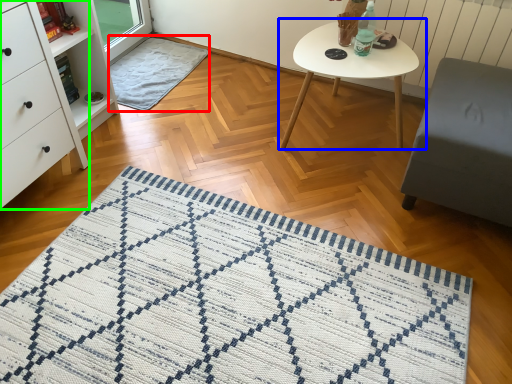
Question: Which object is the closest to the blanket (highlighted by a red box)? Choose among these: coffee table (highlighted by a blue box) or chest of drawers (highlighted by a green box).

Choices:
 (A) coffee table
 (B) chest of drawers

Answer: (B)